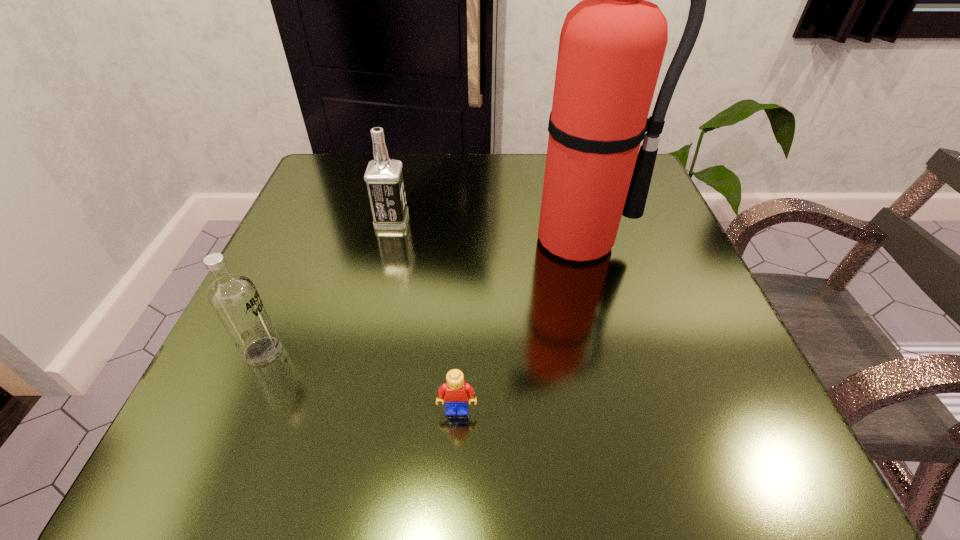
Image resolution: width=960 pixels, height=540 pixels. In order to click on the rightmost object in this screenshot , I will do `click(612, 43)`.

The height and width of the screenshot is (540, 960). What are the coordinates of `the tallest object` in the screenshot? It's located at (612, 43).

The height and width of the screenshot is (540, 960). Find the location of `the right vodka`. the right vodka is located at coordinates (384, 178).

Locate an element on the screen. Image resolution: width=960 pixels, height=540 pixels. the second object from left to right is located at coordinates (384, 178).

You are a GUI agent. You are given a task and a screenshot of the screen. Output one action in this format:
    pyautogui.click(x=<x>, y=<y>)
    Task: Click on the left vodka
    The image size is (960, 540).
    Given the screenshot: What is the action you would take?
    pyautogui.click(x=233, y=297)

Locate an element on the screen. The width and height of the screenshot is (960, 540). the nearer vodka is located at coordinates (233, 297).

This screenshot has width=960, height=540. What are the coordinates of `the shortest object` in the screenshot? It's located at (455, 391).

You are a GUI agent. You are given a task and a screenshot of the screen. Output one action in this format:
    pyautogui.click(x=<x>, y=<y>)
    Task: Click on the Lego
    
    Given the screenshot: What is the action you would take?
    pyautogui.click(x=455, y=391)

Where is `vacant space located at the nozzle of the rightmost object`? vacant space located at the nozzle of the rightmost object is located at coordinates (599, 322).

This screenshot has height=540, width=960. In order to click on vacant space located 0.280m on the front label of the right vodka in this screenshot , I will do `click(545, 220)`.